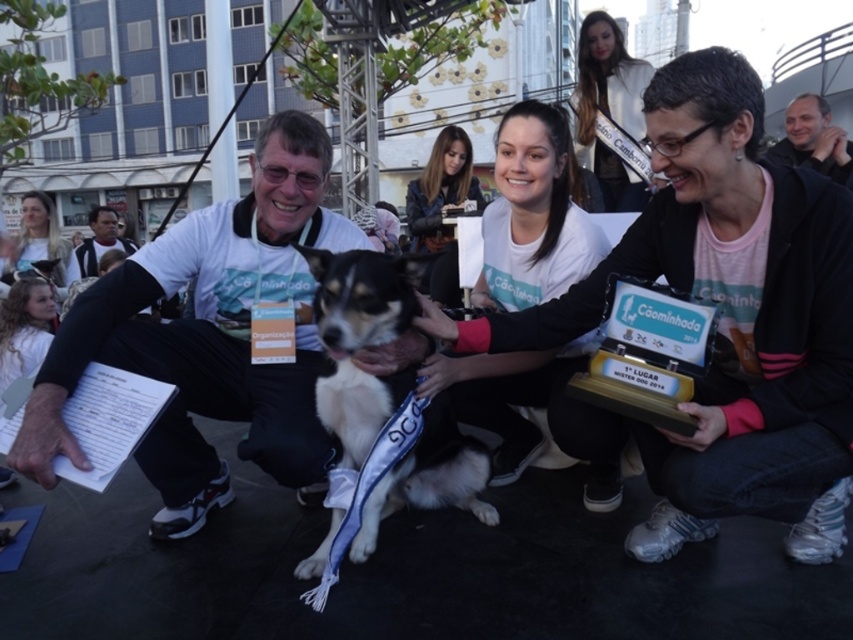
You are a photographer at the event and want to frame a shot that includes both the smooth brown leather jacket at upper center and the light brown hair at upper left. Which object should you position lower in your camera viewfinder?

The smooth brown leather jacket at upper center should be positioned lower in the camera viewfinder because it is below the light brown hair at upper left according to the description.

You are organizing a photo shoot and need to ensure that the metallic trophy at center and the matte black shirt at center are both visible in the frame. Given their sizes, which object should you prioritize positioning closer to the camera to ensure clarity?

The metallic trophy at center has a lesser width compared to matte black shirt at center, so you should prioritize positioning the metallic trophy at center closer to the camera to ensure its details are clearly visible.

Looking at this image, you are a photographer at the event. You need to capture a photo where the metallic trophy at center is fully visible without being blocked by the matte black shirt at center. Based on the scene description, is this possible?

The metallic trophy at center is positioned under the matte black shirt at center, so it would be blocked by the shirt and not fully visible. To capture the trophy clearly, you would need to adjust the angle or position to ensure the shirt does not obscure it.